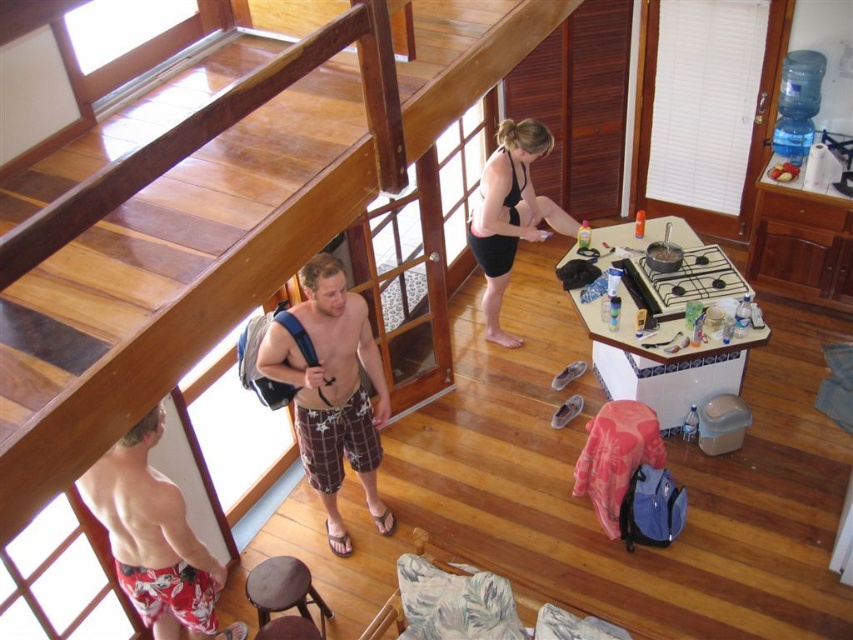
Is wooden at upper center smaller than plaid fabric shorts at center?

Incorrect, wooden at upper center is not smaller in size than plaid fabric shorts at center.

Does wooden at upper center appear over plaid fabric shorts at center?

Yes, wooden at upper center is above plaid fabric shorts at center.

Describe the element at coordinates (166, 253) in the screenshot. I see `wooden at upper center` at that location.

This screenshot has width=853, height=640. What are the coordinates of `wooden at upper center` in the screenshot? It's located at (166, 253).

Who is taller, printed cotton shorts at lower left or brown wooden stool at lower center?

With more height is printed cotton shorts at lower left.

Who is positioned more to the right, printed cotton shorts at lower left or brown wooden stool at lower center?

From the viewer's perspective, brown wooden stool at lower center appears more on the right side.

Where is `printed cotton shorts at lower left`? The image size is (853, 640). printed cotton shorts at lower left is located at coordinates (155, 538).

Can you confirm if plaid fabric shorts at center is thinner than printed cotton shorts at lower left?

In fact, plaid fabric shorts at center might be wider than printed cotton shorts at lower left.

What are the coordinates of `plaid fabric shorts at center` in the screenshot? It's located at click(332, 392).

Where is `plaid fabric shorts at center`? plaid fabric shorts at center is located at coordinates (332, 392).